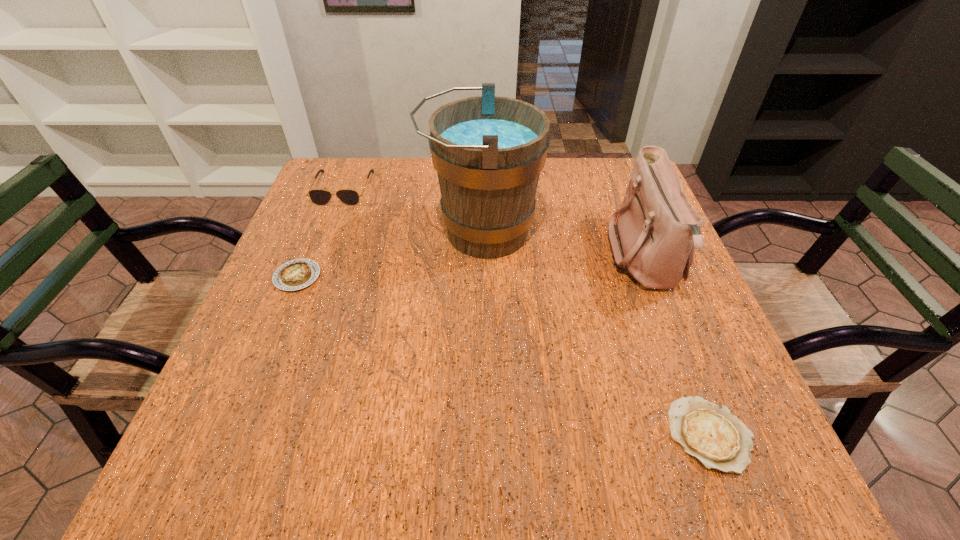
Locate an element on the screen. The image size is (960, 540). vacant space that is in between the fourth shortest object and the right quiche is located at coordinates 678,347.

At what (x,y) coordinates should I click in order to perform the action: click on object that ranks as the third closest to the farther quiche. Please return your answer as a coordinate pair (x, y). Image resolution: width=960 pixels, height=540 pixels. Looking at the image, I should click on (657, 229).

At what (x,y) coordinates should I click in order to perform the action: click on the third closest object relative to the tallest object. Please return your answer as a coordinate pair (x, y). This screenshot has width=960, height=540. Looking at the image, I should click on (299, 273).

I want to click on vacant space that satisfies the following two spatial constraints: 1. with a handle on the side of the right quiche; 2. on the right side of the wine bucket, so click(481, 435).

Image resolution: width=960 pixels, height=540 pixels. Identify the location of free space that satisfies the following two spatial constraints: 1. with a handle on the side of the wine bucket; 2. on the front side of the left quiche. (481, 276).

Locate an element on the screen. Image resolution: width=960 pixels, height=540 pixels. vacant space that satisfies the following two spatial constraints: 1. with a handle on the side of the third object from right to left; 2. on the back side of the nearest object is located at coordinates (481, 435).

I want to click on free space that satisfies the following two spatial constraints: 1. on the front-facing side of the nearest object; 2. on the right side of the sunglasses, so click(248, 435).

You are a GUI agent. You are given a task and a screenshot of the screen. Output one action in this format:
    pyautogui.click(x=<x>, y=<y>)
    Task: Click on the blank space that satisfies the following two spatial constraints: 1. on the front-facing side of the nearest object; 2. on the right side of the third tallest object
    
    Given the screenshot: What is the action you would take?
    pyautogui.click(x=248, y=435)

You are a GUI agent. You are given a task and a screenshot of the screen. Output one action in this format:
    pyautogui.click(x=<x>, y=<y>)
    Task: Click on the free space that satisfies the following two spatial constraints: 1. with a handle on the side of the nearer quiche; 2. on the right side of the third object from left to right
    
    Given the screenshot: What is the action you would take?
    pyautogui.click(x=481, y=435)